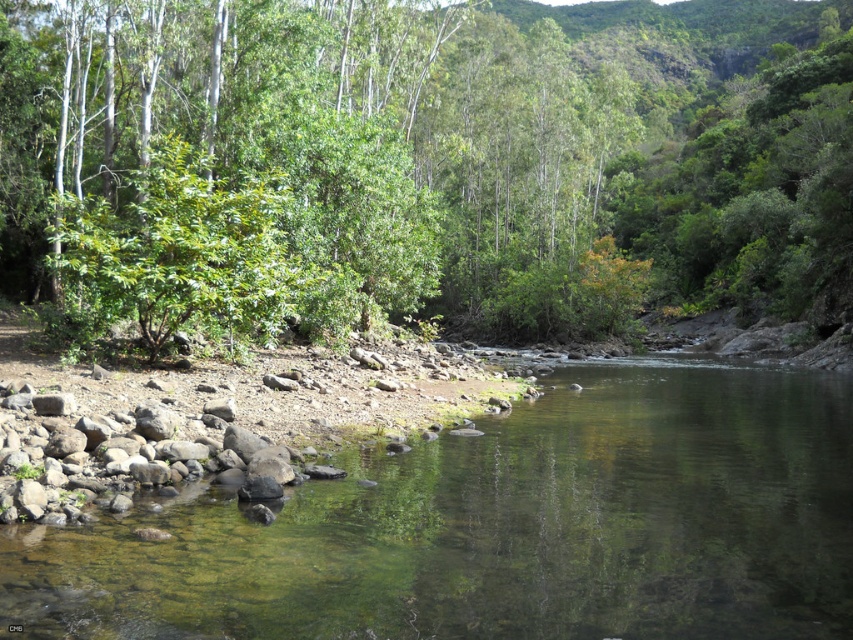
Question: Which of the following is the closest to the observer?

Choices:
 (A) green leafy tree at upper center
 (B) clear water at river center

Answer: (B)

Question: Is green leafy tree at upper center positioned in front of clear water at river center?

Choices:
 (A) yes
 (B) no

Answer: (B)

Question: Does green leafy tree at upper center lie behind clear water at river center?

Choices:
 (A) no
 (B) yes

Answer: (B)

Question: Is green leafy tree at upper center thinner than clear water at river center?

Choices:
 (A) yes
 (B) no

Answer: (B)

Question: Which point is closer to the camera?

Choices:
 (A) green leafy tree at upper center
 (B) clear water at river center
 (C) gray smooth rocks at lower left

Answer: (B)

Question: Which object is closer to the camera taking this photo?

Choices:
 (A) gray smooth rocks at lower left
 (B) clear water at river center

Answer: (B)